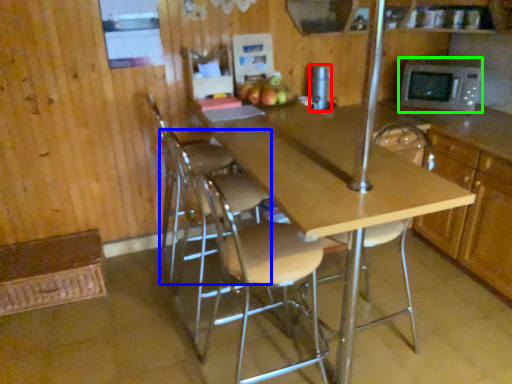
Question: Which object is positioned farthest from appliance (highlighted by a red box)? Select from chair (highlighted by a blue box) and microwave oven (highlighted by a green box).

Choices:
 (A) chair
 (B) microwave oven

Answer: (A)